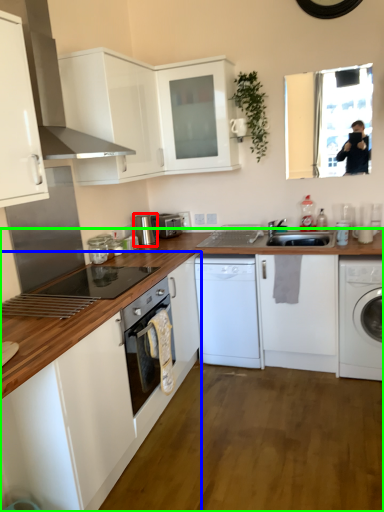
Question: Which object is the farthest from kitchen appliance (highlighted by a red box)? Choose among these: cabinetry (highlighted by a blue box) or cabinetry (highlighted by a green box).

Choices:
 (A) cabinetry
 (B) cabinetry

Answer: (A)